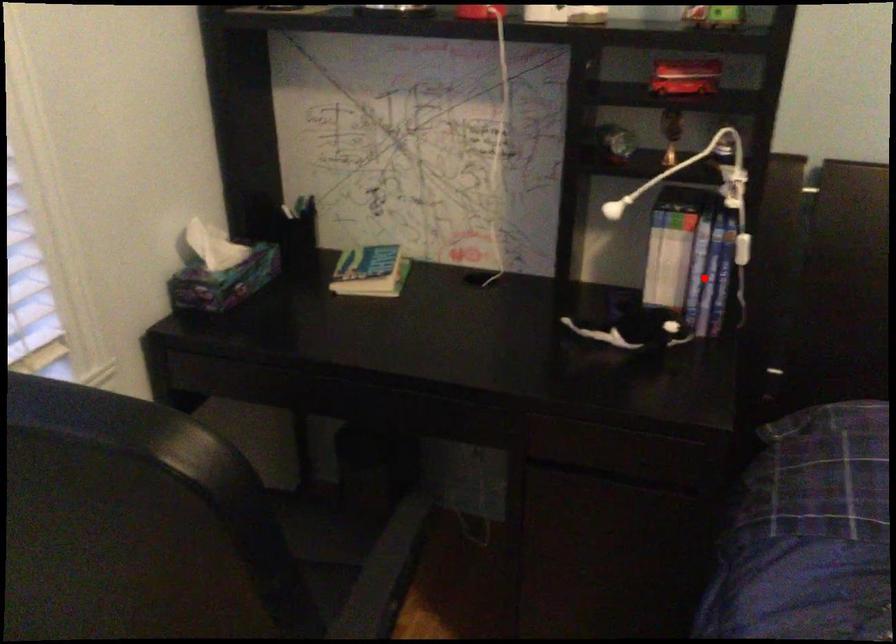
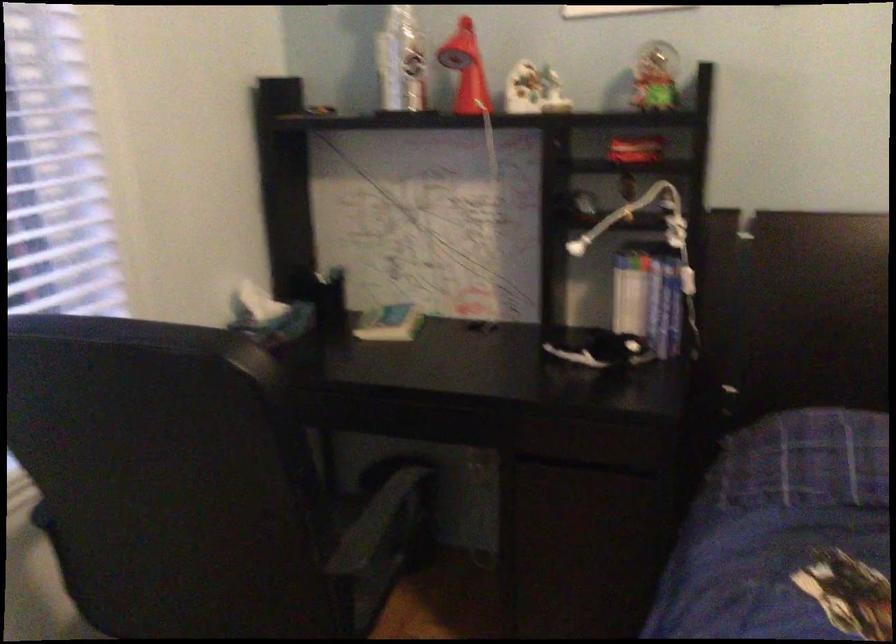
Find the pixel in the second image that matches the highlighted location in the first image.

(664, 307)